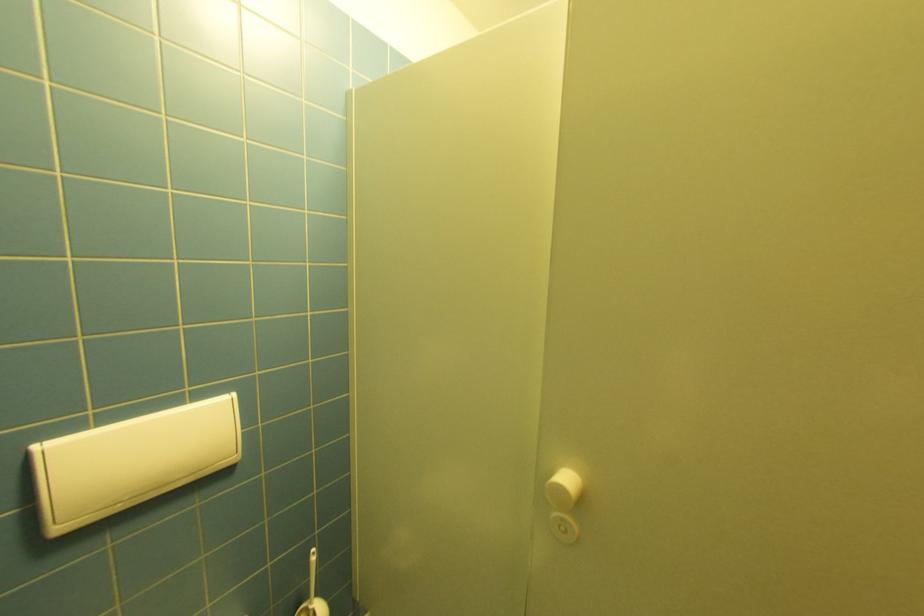
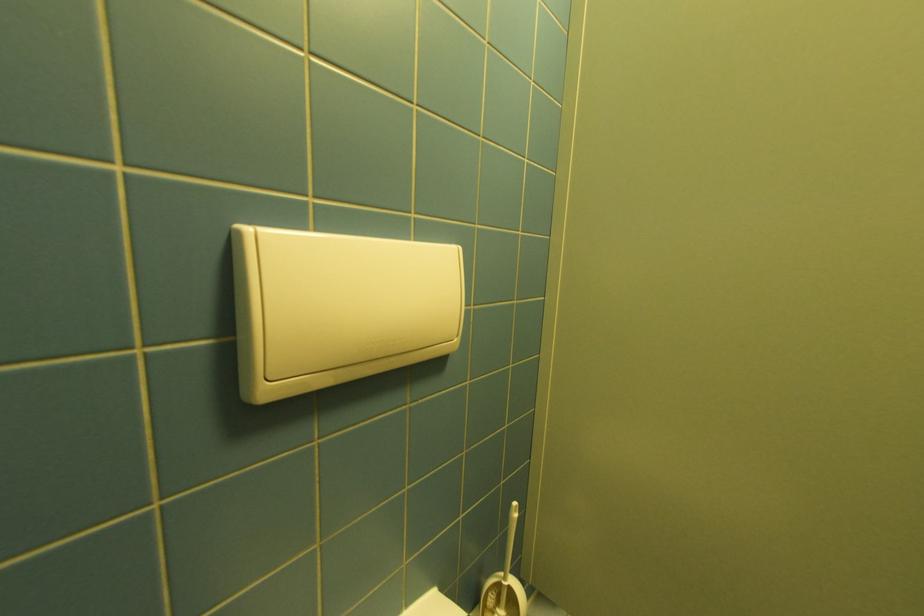
In a continuous first-person perspective shot, in which direction is the camera moving?

The movement direction of the cameraman is left, forward.